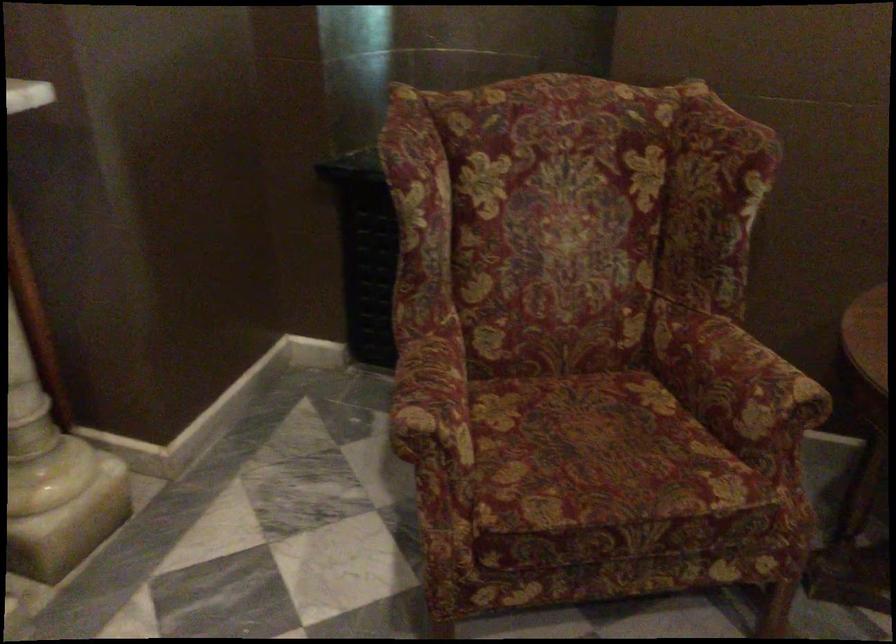
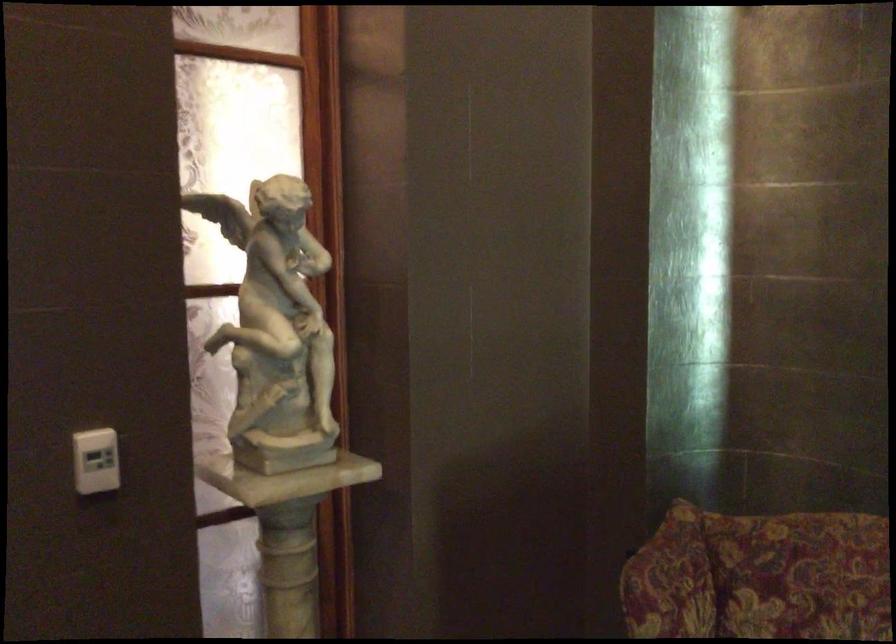
Where in the second image is the point corresponding to (414,147) from the first image?

(670, 581)